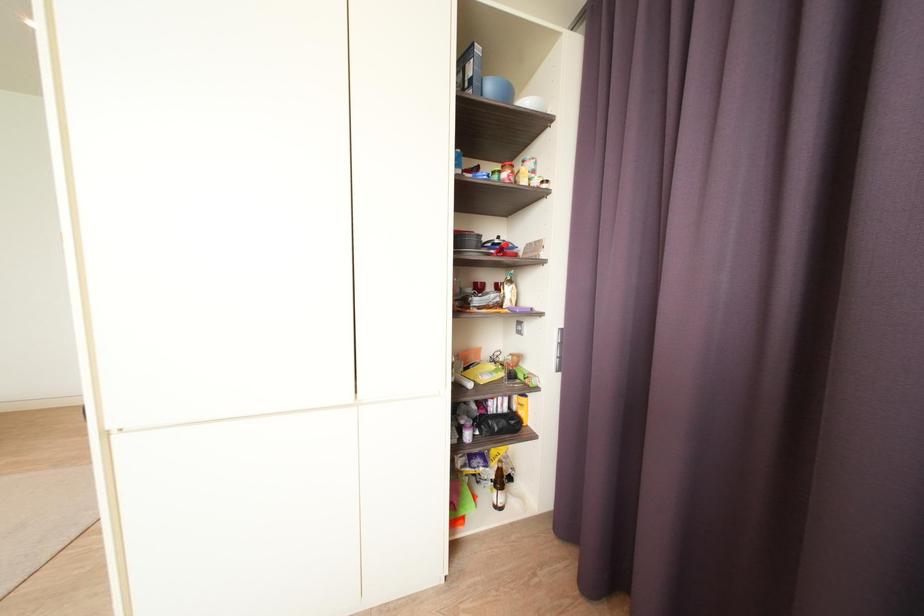
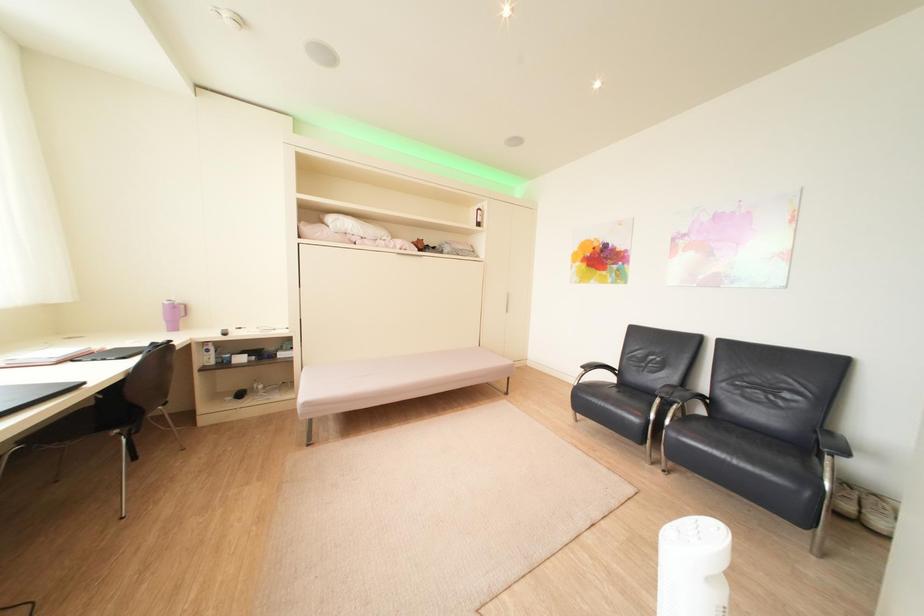
Question: The camera is either moving clockwise (left) or counter-clockwise (right) around the object. The first image is from the beginning of the video and the second image is from the end. Is the camera moving left or right when shooting the video?

Choices:
 (A) Left
 (B) Right

Answer: (B)